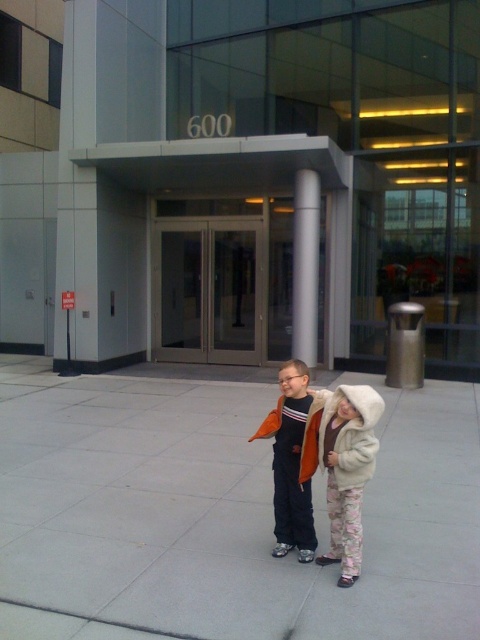
Question: Among these points, which one is nearest to the camera?

Choices:
 (A) (339, 499)
 (B) (313, 472)
 (C) (235, 564)
 (D) (303, 285)

Answer: (A)

Question: Does gray concrete pavement at center have a larger size compared to white glossy pillar at center?

Choices:
 (A) yes
 (B) no

Answer: (B)

Question: Is fluffy white coat at center to the left of white glossy pillar at center from the viewer's perspective?

Choices:
 (A) no
 (B) yes

Answer: (B)

Question: Based on their relative distances, which object is nearer to the orange fleece jacket at center?

Choices:
 (A) white glossy pillar at center
 (B) fluffy white coat at center

Answer: (B)

Question: Which object is the farthest from the orange fleece jacket at center?

Choices:
 (A) fluffy white coat at center
 (B) gray concrete pavement at center

Answer: (B)

Question: Is orange fleece jacket at center below white glossy pillar at center?

Choices:
 (A) yes
 (B) no

Answer: (A)